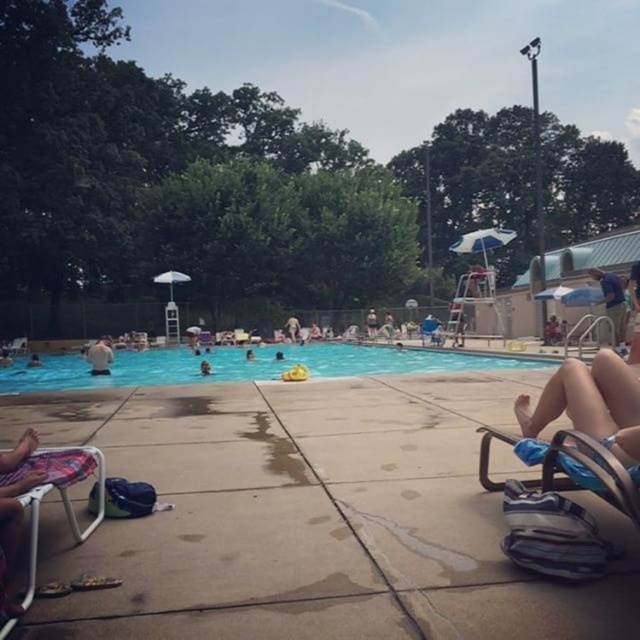
Question: Which point is closer to the camera?

Choices:
 (A) dark blue swim trunks at center
 (B) white matte shirt at upper left
 (C) tan skin at lower right

Answer: (C)

Question: Can you confirm if tan skin at lower right is wider than blue fabric shorts at right?

Choices:
 (A) no
 (B) yes

Answer: (A)

Question: Which object is farther from the camera taking this photo?

Choices:
 (A) dark blue swim trunks at center
 (B) blue smooth water at center

Answer: (A)

Question: Which point is farther from the camera taking this photo?

Choices:
 (A) (32, 492)
 (B) (209, 369)
 (C) (609, 397)

Answer: (B)

Question: Can you confirm if plastic beach chair at lower left is thinner than dark blue swimmer at center?

Choices:
 (A) no
 (B) yes

Answer: (A)

Question: Is blue smooth water at center in front of white matte shirt at upper left?

Choices:
 (A) no
 (B) yes

Answer: (B)